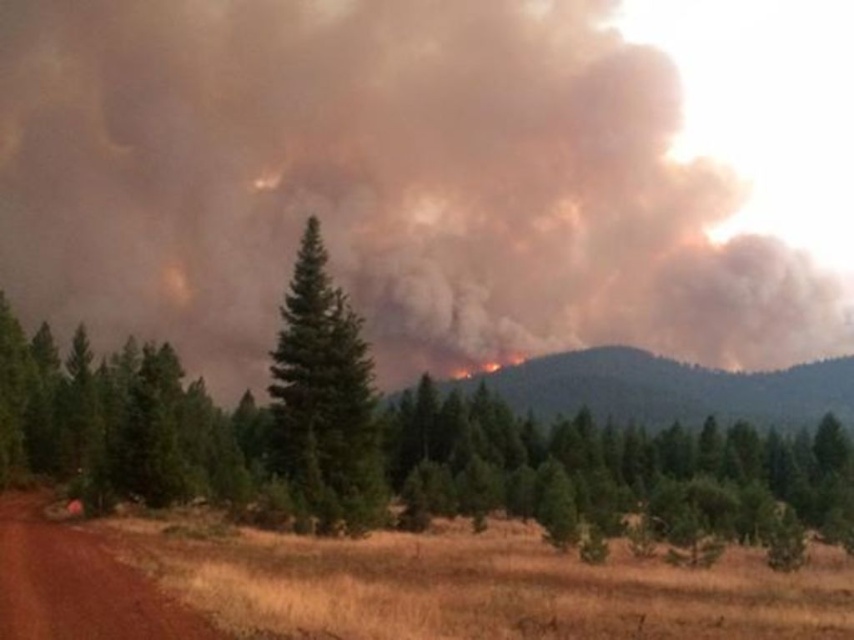
You are a firefighter trying to navigate through the forest fire scene. You need to reach a safe zone located at point (377,182). However, there is brown smoke at upper center at that point. Is the safe zone blocked by the smoke?

The brown smoke at upper center is located at point (377,182), which is exactly where the safe zone is. Therefore, the safe zone is blocked by the smoke.

You are a firefighter assessing the fire situation. You notice brown smoke at upper center and charred vegetation at center. Which object is located to the left of the other?

The brown smoke at upper center is positioned on the left side of charred vegetation at center.